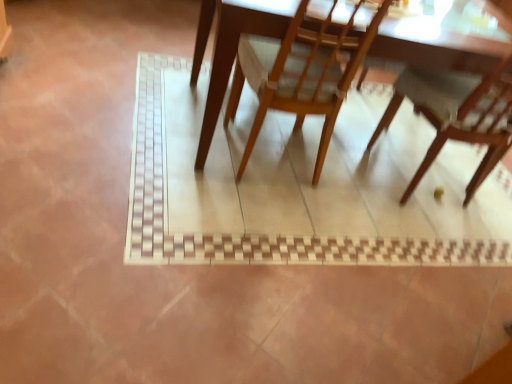
Locate an element on the screen. This screenshot has width=512, height=384. vacant area situated to the left side of wooden chair at center, which ranks as the 2th chair in right-to-left order is located at coordinates (168, 138).